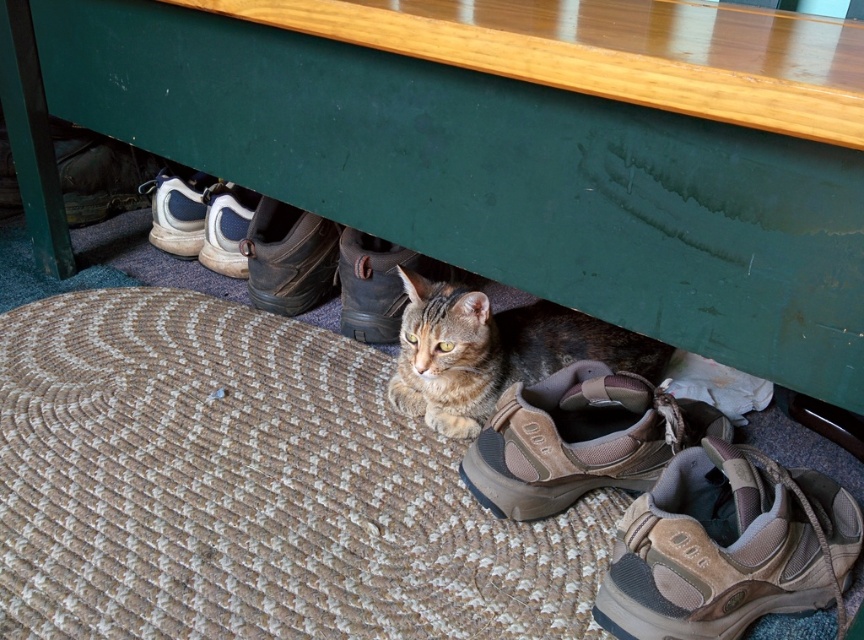
You are a delivery person who needs to place a heavy box on the green painted wood table at center. However, there is a brown suede shoe at center underneath it. Can you safely place the box on the table without damaging the shoe?

The green painted wood table at center is positioned over brown suede shoe at center, so placing the box on the table will not directly affect the shoe underneath since the table covers it. However, ensure the table can support the box safely.

You are a photographer trying to capture the brown suede shoe at center without the green painted wood table at center blocking the view. Can you move closer to the shoe to ensure it is fully visible in your photo?

The green painted wood table at center is closer to the viewer than the brown suede shoe at center. To capture the brown suede shoe at center without obstruction, you would need to move closer to the shoe so that the table no longer blocks the view.

Looking at this image, you are standing in front of the furniture where the cat is resting. There are two points marked on the floor under the furniture. The first point is at coordinates point (354, 193) and the second is at point (206, 266). If you want to place a small toy closer to the camera, which point should you choose?

You should choose point (354, 193) because it is closer to the camera than point (206, 266).